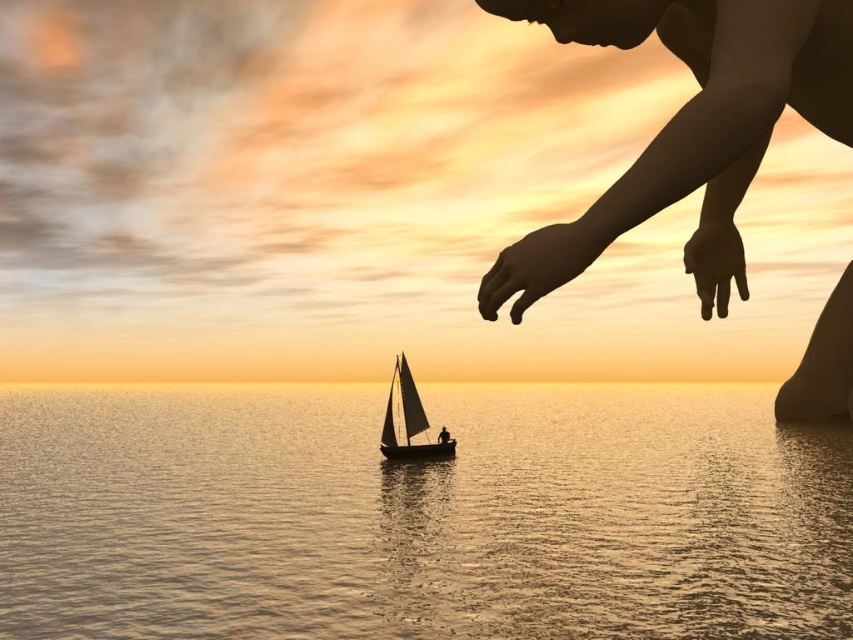
Question: Which point is farther to the camera?

Choices:
 (A) (392, 435)
 (B) (780, 1)
 (C) (39, 412)

Answer: (C)

Question: Does silhouette skin at upper right come behind silky white sail at center?

Choices:
 (A) yes
 (B) no

Answer: (B)

Question: Is silvery reflective water at center wider than silky white sail at center?

Choices:
 (A) yes
 (B) no

Answer: (A)

Question: Which of these objects is positioned closest to the silvery reflective water at center?

Choices:
 (A) silky white sail at center
 (B) silhouette skin at upper right

Answer: (A)

Question: Does silhouette skin at upper right have a smaller size compared to silky white sail at center?

Choices:
 (A) no
 (B) yes

Answer: (B)

Question: Which of the following is the closest to the observer?

Choices:
 (A) silhouette skin at upper right
 (B) silky white sail at center

Answer: (A)